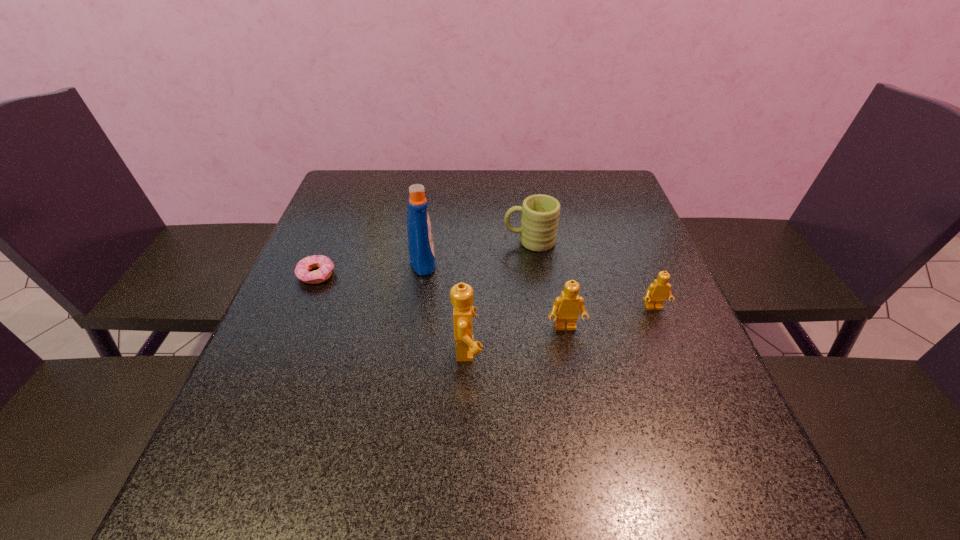
The height and width of the screenshot is (540, 960). I want to click on empty space that is in between the tallest object and the doughnut, so click(370, 268).

Locate an element on the screen. free space between the fifth object from right to left and the rightmost object is located at coordinates (539, 284).

This screenshot has height=540, width=960. In order to click on unoccupied position between the mug and the second tallest object in this screenshot , I will do `click(499, 295)`.

Where is `free point between the fifth object from right to left and the mug`? The width and height of the screenshot is (960, 540). free point between the fifth object from right to left and the mug is located at coordinates (476, 251).

In order to click on free space that is in between the second Lego from right to left and the doughnut in this screenshot , I will do `click(441, 301)`.

The image size is (960, 540). Identify the location of object that is the nearest to the second shortest Lego. (657, 292).

Locate which object is the fifth closest to the doughnut. Please provide its 2D coordinates. Your answer should be formatted as a tuple, i.e. [(x, y)], where the tuple contains the x and y coordinates of a point satisfying the conditions above.

[(657, 292)]

What are the coordinates of `Lego that is the closest to the mug` in the screenshot? It's located at (566, 309).

Where is `the closest Lego to the leftmost object`? the closest Lego to the leftmost object is located at coordinates (462, 295).

At what (x,y) coordinates should I click in order to perform the action: click on vacant area in the image that satisfies the following two spatial constraints: 1. on the side of the mug with the handle; 2. on the front side of the doughnut. Please return your answer as a coordinate pair (x, y). This screenshot has height=540, width=960. Looking at the image, I should click on (534, 275).